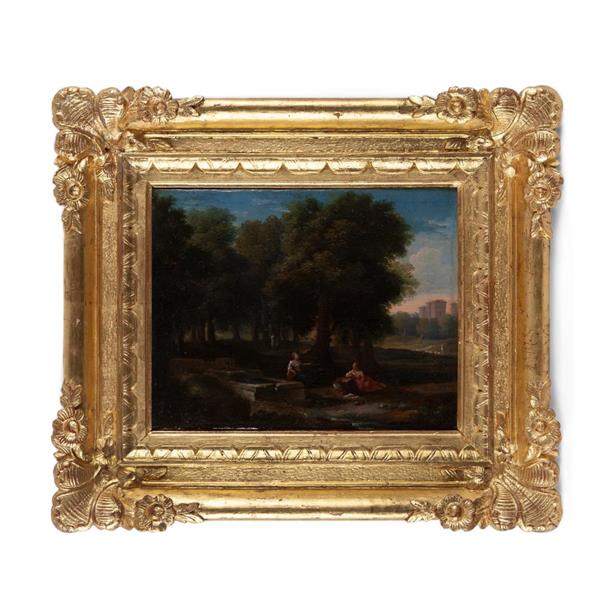
Where is `gold frame`? The image size is (600, 600). gold frame is located at coordinates (108, 290).